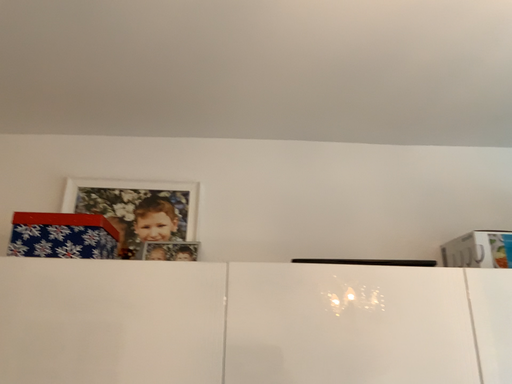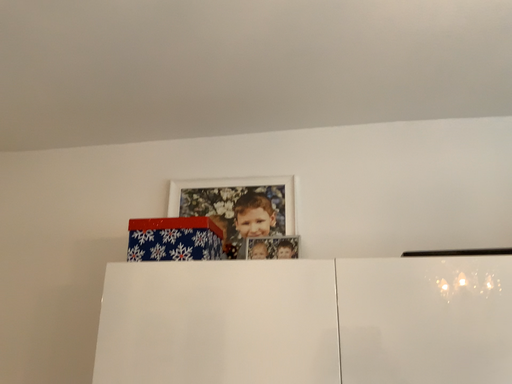
Question: Which way did the camera rotate in the video?

Choices:
 (A) rotated right
 (B) rotated left

Answer: (B)